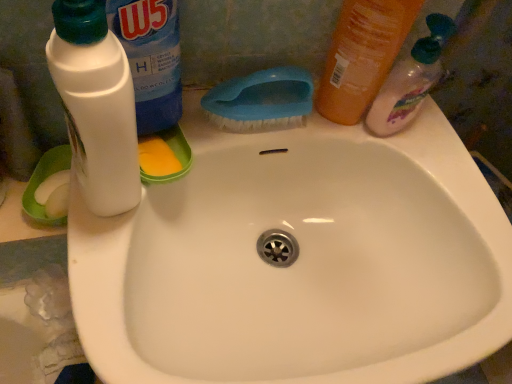
Question: From a real-world perspective, relative to translucent plastic bottle at upper right, acting as the 2th cleaning product starting from the right, is white plastic bottle at upper left, the 3th cleaning product viewed from the right, vertically above or below?

Choices:
 (A) below
 (B) above

Answer: (B)

Question: Based on their positions, is white plastic bottle at upper left, the 3th cleaning product viewed from the right, located to the left or right of translucent plastic bottle at upper right, acting as the 2th cleaning product starting from the right?

Choices:
 (A) right
 (B) left

Answer: (B)

Question: Which object is positioned farthest from the white glossy sink at center?

Choices:
 (A) translucent plastic bottle at upper right, marked as the 1th cleaning product in a right-to-left arrangement
 (B) white matte bottle at left
 (C) blue plastic brush at upper center
 (D) translucent plastic bottle at upper right, acting as the 2th cleaning product starting from the right
 (E) white plastic bottle at upper left, the 3th cleaning product viewed from the right

Answer: (E)

Question: Which object is positioned closest to the translucent plastic bottle at upper right, acting as the 2th cleaning product starting from the right?

Choices:
 (A) white plastic bottle at upper left, the 1th cleaning product from the left
 (B) white glossy sink at center
 (C) blue plastic brush at upper center
 (D) white matte bottle at left
 (E) translucent plastic bottle at upper right, marked as the 1th cleaning product in a right-to-left arrangement

Answer: (E)